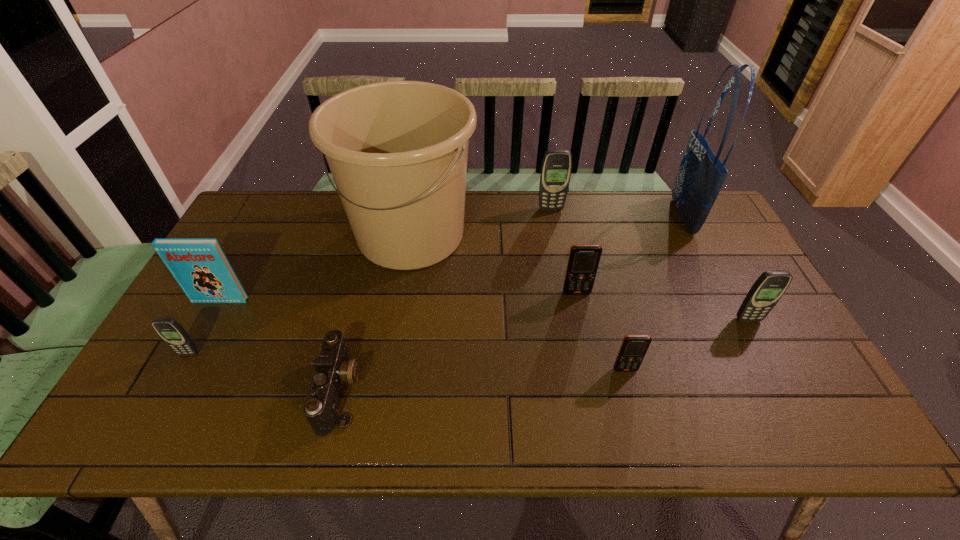
At what (x,y) coordinates should I click in order to perform the action: click on object located in the near edge section of the desktop. Please return your answer as a coordinate pair (x, y). Image resolution: width=960 pixels, height=540 pixels. Looking at the image, I should click on pyautogui.click(x=333, y=368).

The width and height of the screenshot is (960, 540). I want to click on book located in the left edge section of the desktop, so click(x=201, y=268).

Find the location of a particular element. The width and height of the screenshot is (960, 540). cellular telephone present at the left edge is located at coordinates (173, 334).

Find the location of a particular element. shopping bag that is at the right edge is located at coordinates (701, 175).

Find the location of a particular element. cellular telephone that is positioned at the right edge is located at coordinates (767, 290).

This screenshot has width=960, height=540. Find the location of `object located at the far right corner`. object located at the far right corner is located at coordinates (701, 175).

Find the location of a particular element. The image size is (960, 540). vacant space at the far edge of the desktop is located at coordinates (584, 204).

The width and height of the screenshot is (960, 540). In the image, there is a desktop. In order to click on vacant space at the near edge in this screenshot , I will do `click(502, 429)`.

What are the coordinates of `vacant region at the left edge of the desktop` in the screenshot? It's located at pos(192,310).

Image resolution: width=960 pixels, height=540 pixels. Find the location of `vacant space at the right edge of the desktop`. vacant space at the right edge of the desktop is located at coordinates (710, 291).